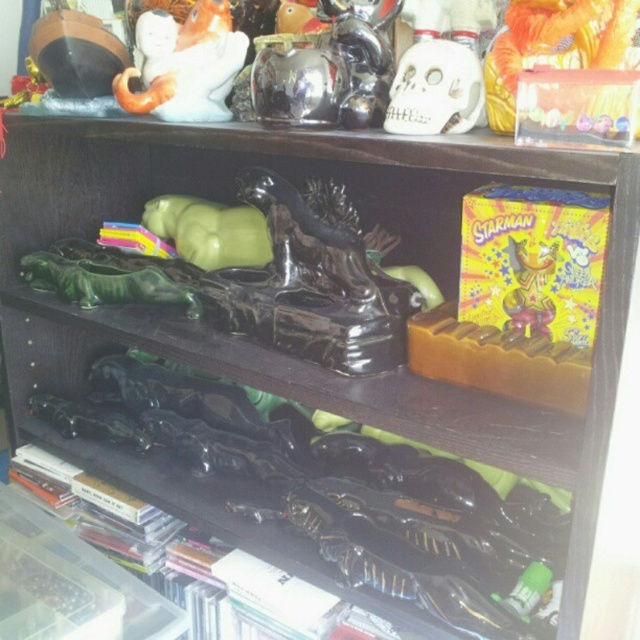
Question: Does green rubber toy at center appear on the right side of shiny yellow plastic toy at upper right?

Choices:
 (A) yes
 (B) no

Answer: (B)

Question: Which point is farther from the camera taking this photo?

Choices:
 (A) (120, 83)
 (B) (509, 76)

Answer: (A)

Question: Which of the following is the closest to the observer?

Choices:
 (A) shiny yellow plastic toy at upper right
 (B) green rubber toy at center
 (C) white glossy statue at upper left

Answer: (A)

Question: Which object is the closest to the green rubber toy at center?

Choices:
 (A) white glossy statue at upper left
 (B) white matte skull at upper center
 (C) orange plastic toy at upper right
 (D) shiny yellow plastic toy at upper right

Answer: (A)

Question: Can you confirm if orange plastic toy at upper right is thinner than white matte skull at upper center?

Choices:
 (A) yes
 (B) no

Answer: (B)

Question: Does white matte skull at upper center appear on the right side of shiny yellow plastic toy at upper right?

Choices:
 (A) no
 (B) yes

Answer: (A)